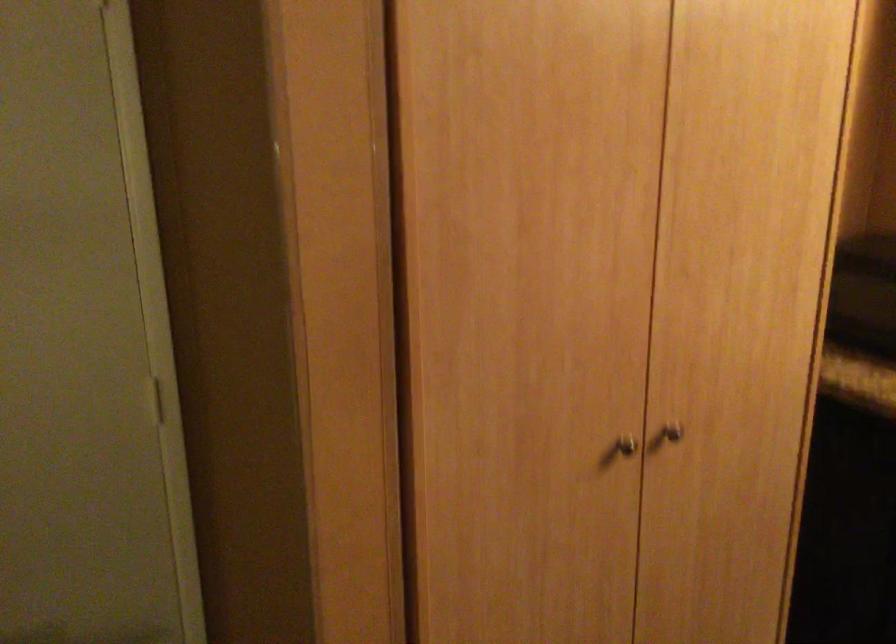
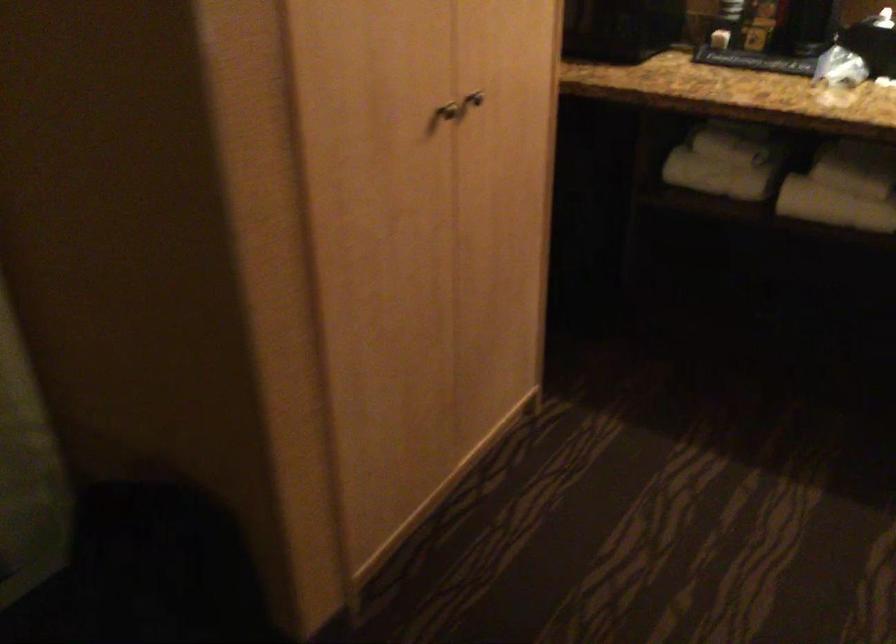
Question: How did the camera likely rotate?

Choices:
 (A) Left
 (B) Right
 (C) Up
 (D) Down

Answer: (B)